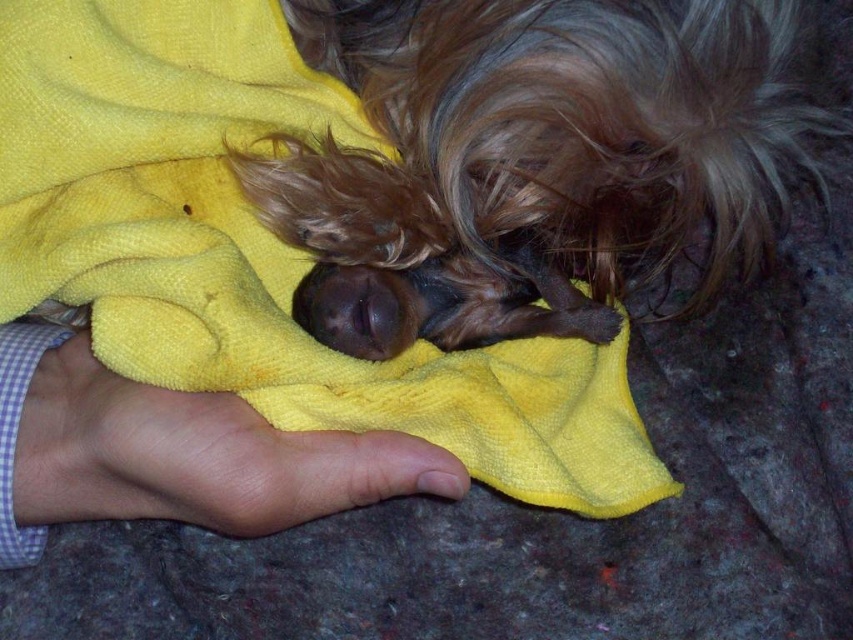
You are a photographer setting up a photo shoot for a pet magazine. You need to ensure that the yellow towel at center and the smooth skin hand at lower left are framed properly. Which object should you adjust to make them appear the same height in the photo?

Since the yellow towel at center has a greater height compared to the smooth skin hand at lower left, you should lower the yellow towel at center or raise the smooth skin hand at lower left to make them appear the same height in the photo.

You are a photographer standing 30.52 inches away from a point marked at coordinates point (416, 140). You want to take a closeup photo of the newborn puppy being held by the person. Is your current distance sufficient to capture the entire puppy in the frame?

The point marked at coordinates point (416, 140) is 30.52 inches away from you. Since the puppy is being held close to this point, your current distance should allow you to capture the entire puppy in the frame.

You are a veterinarian examining the image. You need to determine if the shaggy brown fur at center is resting on the smooth skin hand at lower left. Based on the spatial relationship, what can you conclude?

The shaggy brown fur at center is positioned over the smooth skin hand at lower left, so the shaggy brown fur at center is resting on the smooth skin hand at lower left.